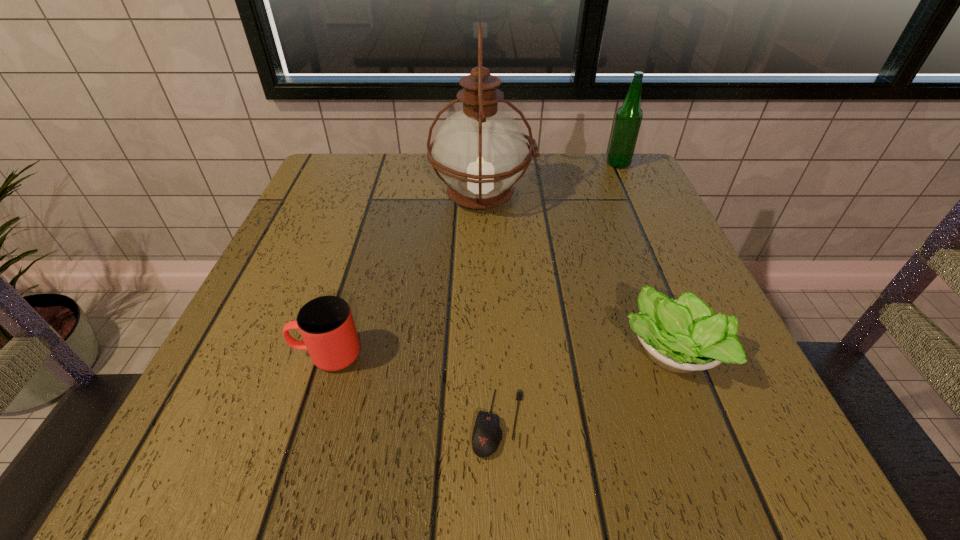
This screenshot has width=960, height=540. I want to click on the second farthest object, so click(479, 152).

The image size is (960, 540). In order to click on the tallest object in this screenshot , I will do `click(479, 152)`.

Identify the location of the farthest object. (629, 116).

Identify the location of beer bottle. The height and width of the screenshot is (540, 960). (629, 116).

The height and width of the screenshot is (540, 960). In order to click on the leftmost object in this screenshot , I will do `click(326, 324)`.

Image resolution: width=960 pixels, height=540 pixels. What are the coordinates of `lettuce` in the screenshot? It's located at (682, 336).

This screenshot has width=960, height=540. What are the coordinates of `mouse` in the screenshot? It's located at (487, 434).

I want to click on free space located on the back of the second farthest object, so click(x=482, y=154).

Locate an element on the screen. This screenshot has width=960, height=540. free space located 0.150m on the label of the farthest object is located at coordinates (546, 164).

Locate an element on the screen. Image resolution: width=960 pixels, height=540 pixels. vacant position located on the label of the farthest object is located at coordinates (526, 164).